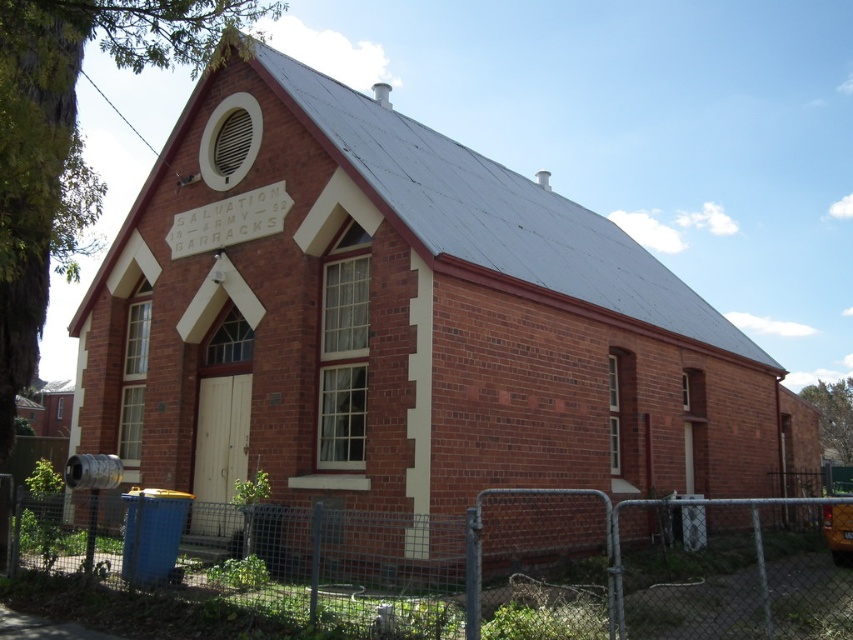
Looking at this image, you are standing 50 feet away from the brick building. You want to approach the point marked at coordinates point (488, 499). How many more feet do you need to walk forward to reach that point?

The distance of point (488, 499) from viewer is 37.62 feet. Since you are currently 50 feet away, you need to walk forward 50 minus 37.62 equals 12.38 feet more to reach the point.

What is the object located at the coordinates point (471, 564)?

The point (471, 564) corresponds to the metal chain link fence at lower center.